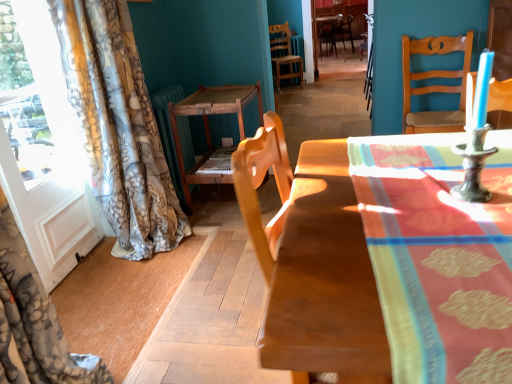
Question: Is wooden chair at center, the 2th chair from the back, in front of wooden chair at center, marked as the third chair in a bottom-to-top arrangement?

Choices:
 (A) no
 (B) yes

Answer: (B)

Question: Is wooden chair at center, the second chair ordered from the bottom, completely or partially outside of wooden chair at center, marked as the third chair in a bottom-to-top arrangement?

Choices:
 (A) yes
 (B) no

Answer: (A)

Question: Is wooden chair at center, the 2th chair from the back, not close to wooden chair at center, which is the first chair from top to bottom?

Choices:
 (A) yes
 (B) no

Answer: (A)

Question: From a real-world perspective, is wooden chair at center, which appears as the 3th chair when viewed from the right, located beneath wooden chair at center, marked as the third chair in a left-to-right arrangement?

Choices:
 (A) no
 (B) yes

Answer: (B)

Question: From the image's perspective, would you say wooden chair at center, marked as the 2th chair in a top-to-bottom arrangement, is positioned over wooden chair at center, marked as the third chair in a left-to-right arrangement?

Choices:
 (A) no
 (B) yes

Answer: (A)

Question: Which is correct: wooden chair at center, marked as the third chair in a bottom-to-top arrangement, is inside wooden table at center, marked as the second table in a front-to-back arrangement, or outside of it?

Choices:
 (A) inside
 (B) outside

Answer: (B)

Question: In terms of width, does wooden chair at center, marked as the 3th chair in a front-to-back arrangement, look wider or thinner when compared to wooden table at center, arranged as the second table when viewed from the right?

Choices:
 (A) thin
 (B) wide

Answer: (B)

Question: From the image's perspective, is wooden chair at center, acting as the first chair starting from the right, positioned above or below wooden table at center, arranged as the second table when viewed from the right?

Choices:
 (A) above
 (B) below

Answer: (A)

Question: From a real-world perspective, relative to wooden table at center, arranged as the second table when viewed from the right, is wooden chair at center, acting as the first chair starting from the right, vertically above or below?

Choices:
 (A) above
 (B) below

Answer: (A)

Question: Is metallic candle holder at right bigger or smaller than wooden table at center, the second table when ordered from left to right?

Choices:
 (A) big
 (B) small

Answer: (B)

Question: Considering the relative positions of metallic candle holder at right and wooden table at center, the second table when ordered from left to right, in the image provided, is metallic candle holder at right to the left or to the right of wooden table at center, the second table when ordered from left to right,?

Choices:
 (A) right
 (B) left

Answer: (B)

Question: From the image's perspective, is metallic candle holder at right located above or below wooden table at center, which is counted as the 1th table, starting from the right?

Choices:
 (A) below
 (B) above

Answer: (B)

Question: Is point (454, 195) positioned closer to the camera than point (471, 284)?

Choices:
 (A) farther
 (B) closer

Answer: (A)

Question: Considering their positions, is wooden chair at center, acting as the first chair starting from the back, located in front of or behind wooden chair at right, the first chair from the bottom?

Choices:
 (A) front
 (B) behind

Answer: (B)

Question: Do you think wooden chair at center, acting as the first chair starting from the back, is within wooden chair at right, which is the third chair in back-to-front order, or outside of it?

Choices:
 (A) outside
 (B) inside

Answer: (A)